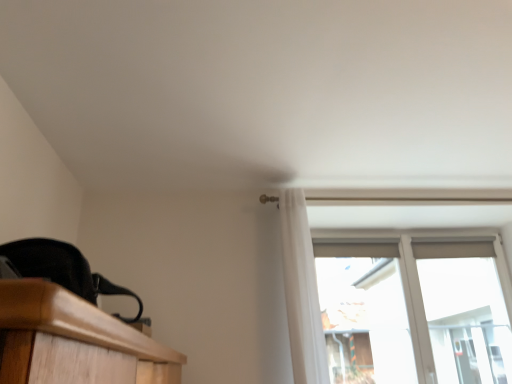
Question: Considering the relative sizes of white sheer curtain at upper center and transparent glass window at upper right in the image provided, is white sheer curtain at upper center taller than transparent glass window at upper right?

Choices:
 (A) no
 (B) yes

Answer: (A)

Question: Considering the relative sizes of white sheer curtain at upper center and transparent glass window at upper right in the image provided, is white sheer curtain at upper center wider than transparent glass window at upper right?

Choices:
 (A) no
 (B) yes

Answer: (B)

Question: Is white sheer curtain at upper center turned away from transparent glass window at upper right?

Choices:
 (A) no
 (B) yes

Answer: (A)

Question: From the image's perspective, does white sheer curtain at upper center appear lower than transparent glass window at upper right?

Choices:
 (A) yes
 (B) no

Answer: (B)

Question: From the image's perspective, is white sheer curtain at upper center over transparent glass window at upper right?

Choices:
 (A) yes
 (B) no

Answer: (A)

Question: Is transparent glass window at upper right a part of white sheer curtain at upper center?

Choices:
 (A) no
 (B) yes

Answer: (A)

Question: From a real-world perspective, is transparent glass window at upper right located higher than white sheer curtain at upper center?

Choices:
 (A) yes
 (B) no

Answer: (B)

Question: From a real-world perspective, is transparent glass window at upper right below white sheer curtain at upper center?

Choices:
 (A) yes
 (B) no

Answer: (A)

Question: Is transparent glass window at upper right next to white sheer curtain at upper center?

Choices:
 (A) no
 (B) yes

Answer: (A)

Question: Would you say transparent glass window at upper right is a long distance from white sheer curtain at upper center?

Choices:
 (A) yes
 (B) no

Answer: (A)

Question: Can you confirm if transparent glass window at upper right is smaller than white sheer curtain at upper center?

Choices:
 (A) yes
 (B) no

Answer: (B)

Question: Is transparent glass window at upper right looking in the opposite direction of white sheer curtain at upper center?

Choices:
 (A) yes
 (B) no

Answer: (B)

Question: From their relative heights in the image, would you say transparent glass window at upper right is taller or shorter than white sheer curtain at upper center?

Choices:
 (A) tall
 (B) short

Answer: (A)